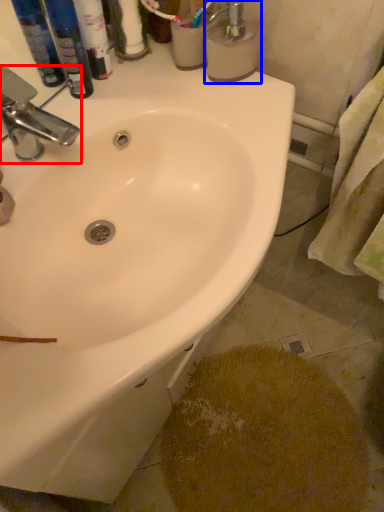
Question: Which of the following is the closest to the observer, tap (highlighted by a red box) or soap dispenser (highlighted by a blue box)?

Choices:
 (A) tap
 (B) soap dispenser

Answer: (A)